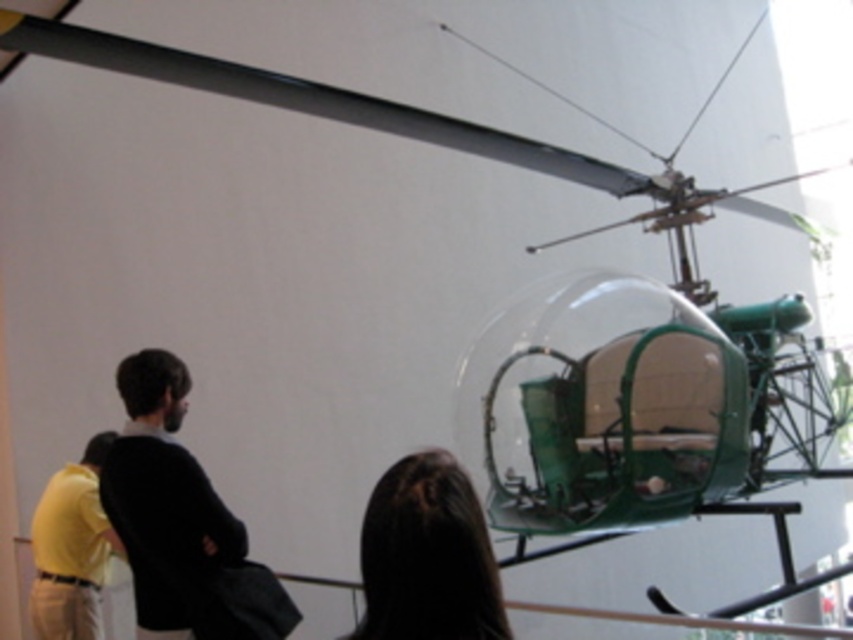
You are standing in the museum and want to take a photo of the vintage helicopter. There is a person wearing a dark brown leather jacket at left blocking your view. Where should you move to avoid the person?

You should move to the right side of the dark brown leather jacket at left to avoid blocking the view, since the jacket is positioned at point (180, 522) which is on the left side of the scene.

You are standing in the museum and want to take a photo of the vintage helicopter without any people blocking the view. The dark brown leather jacket at left is currently in the way. Where should you move to ensure the jacket is not in your shot?

Move to the right side of the dark brown leather jacket at left since it is positioned at point 0.816 on the x and 0.212 on the y coordinates, which would allow you to frame the helicopter without obstruction from the jacket.

You are a photographer trying to capture a clear photo of the dark brown hair at center and the yellow matte shirt at lower left. Which object would you focus on first if you want to ensure both are in focus?

The dark brown hair at center has a lesser width compared to yellow matte shirt at lower left, so you should focus on the dark brown hair at center first to ensure both are in focus.